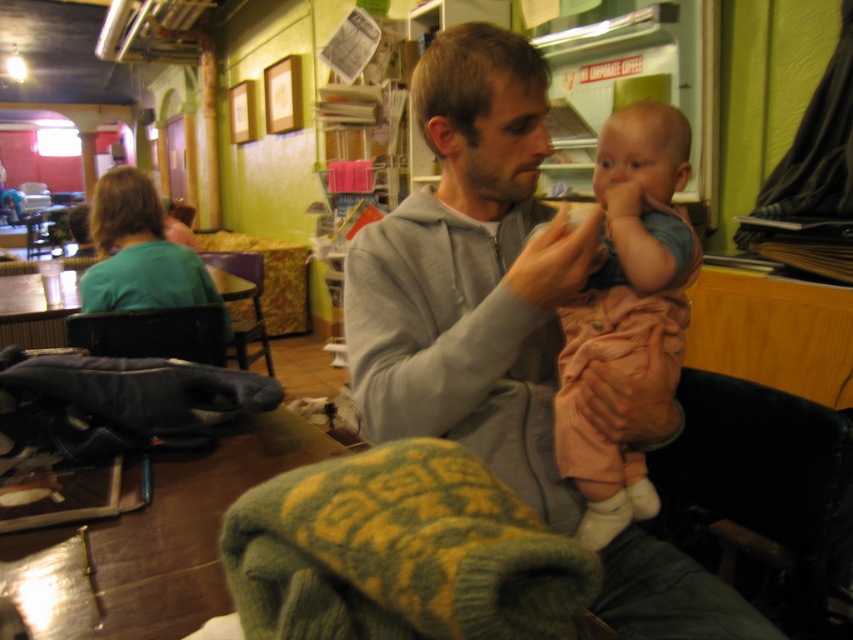
You are a customer entering the cafe and want to sit down. There is a matte green shirt at upper left and a wooden chair at center. Which object should you approach to find a seat?

The wooden chair at center is the object you should approach to find a seat because it is a chair, while the matte green shirt at upper left is just an article of clothing and not a seating option.

You are trying to decide between sitting in the black leather chair at lower left or the wooden chair at center. Which chair has a smaller width?

The black leather chair at lower left has a smaller width than the wooden chair at center.